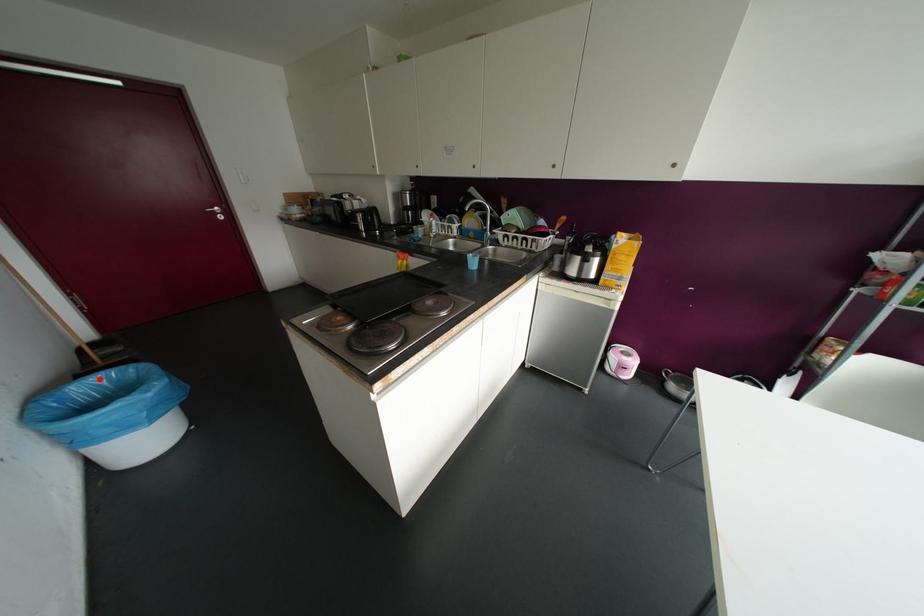
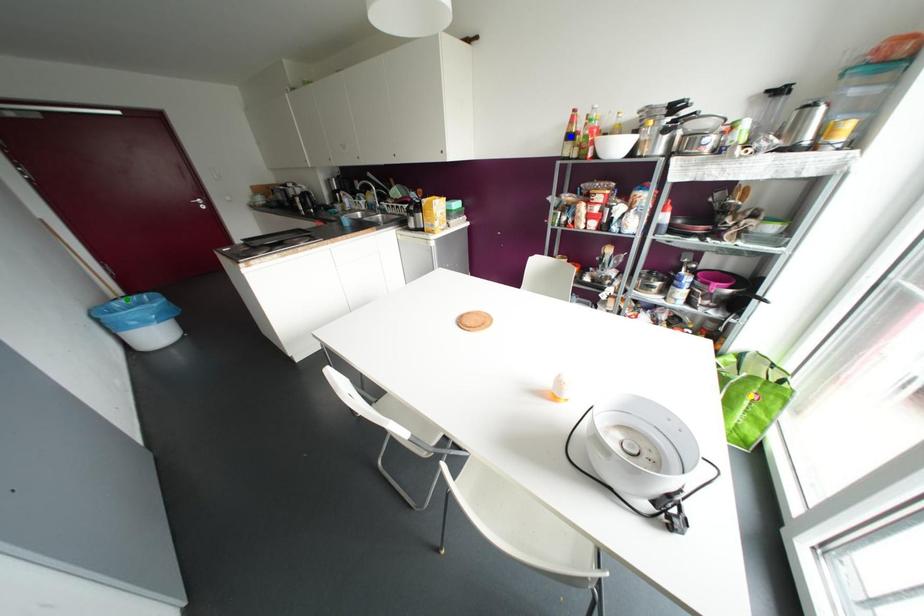
Question: I am providing you with two images of the same scene from different viewpoints. A red point is marked on the first image. You are given multiple points on the second image. Which mark in image 2 goes with the point in image 1?

Choices:
 (A) blue point
 (B) yellow point
 (C) green point

Answer: (C)